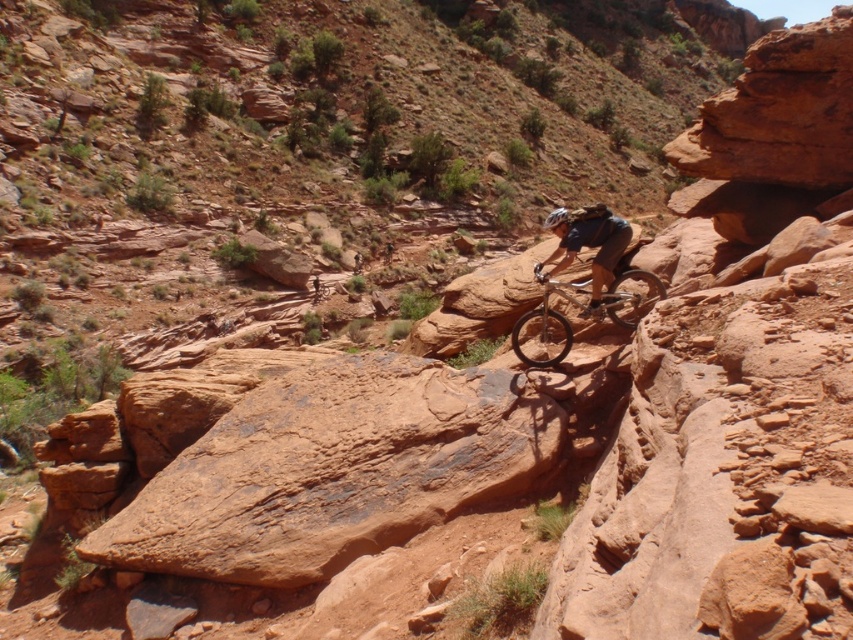
You are standing at the point marked as point (601, 298) in the desert scene. You want to take a photo of the cyclist using a camera that has a 50mm lens. The camera is set to a focal length of 50mm. The cyclist is 11.03 meters away from your current position. If the cyclist is exactly at the center of your camera viewfinder, will the cyclist appear larger or smaller in the photo compared to when you are 5 meters away?

The cyclist will appear smaller in the photo when you are 11.03 meters away compared to when you are 5 meters away because the distance between the camera and the cyclist increases, making the cyclist appear smaller in the image.

You are a hiker planning to carry both the silver metallic mountain bike at center and the shiny black helmet at center in your car trunk. Given their sizes, which item will require more trunk space?

The shiny black helmet at center requires more trunk space because the silver metallic mountain bike at center occupies less space than it.